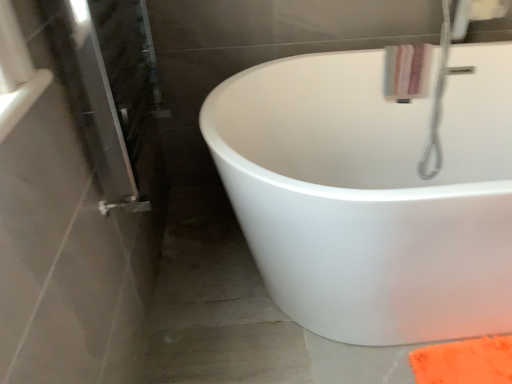
What do you see at coordinates (372, 194) in the screenshot?
I see `white glossy bathtub at center` at bounding box center [372, 194].

The width and height of the screenshot is (512, 384). Find the location of `white glossy bathtub at center`. white glossy bathtub at center is located at coordinates (372, 194).

Locate an element on the screen. This screenshot has height=384, width=512. striped cotton bath towel at upper right is located at coordinates (407, 71).

This screenshot has width=512, height=384. What do you see at coordinates (407, 71) in the screenshot?
I see `striped cotton bath towel at upper right` at bounding box center [407, 71].

The height and width of the screenshot is (384, 512). Identify the location of white glossy bathtub at center. (372, 194).

Considering the positions of objects striped cotton bath towel at upper right and white glossy bathtub at center in the image provided, who is more to the right, striped cotton bath towel at upper right or white glossy bathtub at center?

striped cotton bath towel at upper right.

In the scene shown: Which object is closer to the camera, striped cotton bath towel at upper right or white glossy bathtub at center?

white glossy bathtub at center is more forward.

Between point (412, 95) and point (347, 330), which one is positioned in front?

The point (347, 330) is in front.

From the image's perspective, is striped cotton bath towel at upper right located beneath white glossy bathtub at center?

No, from the image's perspective, striped cotton bath towel at upper right is not below white glossy bathtub at center.

From a real-world perspective, which is physically below, striped cotton bath towel at upper right or white glossy bathtub at center?

white glossy bathtub at center.

Which object is wider, striped cotton bath towel at upper right or white glossy bathtub at center?

With larger width is white glossy bathtub at center.

In the scene shown: Is striped cotton bath towel at upper right shorter than white glossy bathtub at center?

Correct, striped cotton bath towel at upper right is not as tall as white glossy bathtub at center.

From the picture: Between striped cotton bath towel at upper right and white glossy bathtub at center, which one has smaller size?

Smaller between the two is striped cotton bath towel at upper right.

Is striped cotton bath towel at upper right surrounding white glossy bathtub at center?

Actually, white glossy bathtub at center is outside striped cotton bath towel at upper right.

Is striped cotton bath towel at upper right with white glossy bathtub at center?

No, striped cotton bath towel at upper right is not with white glossy bathtub at center.

Is striped cotton bath towel at upper right oriented towards white glossy bathtub at center?

Yes, striped cotton bath towel at upper right faces towards white glossy bathtub at center.

Identify the location of bath towel above the white glossy bathtub at center (from the image's perspective). This screenshot has height=384, width=512. (407, 71).

Consider the image. Does white glossy bathtub at center appear on the right side of striped cotton bath towel at upper right?

No, white glossy bathtub at center is not to the right of striped cotton bath towel at upper right.

Consider the image. Considering the relative positions of white glossy bathtub at center and striped cotton bath towel at upper right in the image provided, is white glossy bathtub at center behind striped cotton bath towel at upper right?

No, the depth of white glossy bathtub at center is less than that of striped cotton bath towel at upper right.

Which is nearer, (365, 201) or (398, 68)?

Point (365, 201) is closer to the camera than point (398, 68).

From the image's perspective, would you say white glossy bathtub at center is shown under striped cotton bath towel at upper right?

Correct, white glossy bathtub at center appears lower than striped cotton bath towel at upper right in the image.

From a real-world perspective, is white glossy bathtub at center below striped cotton bath towel at upper right?

Yes, from a real-world perspective, white glossy bathtub at center is beneath striped cotton bath towel at upper right.

Can you confirm if white glossy bathtub at center is wider than striped cotton bath towel at upper right?

Indeed, white glossy bathtub at center has a greater width compared to striped cotton bath towel at upper right.

Considering the sizes of objects white glossy bathtub at center and striped cotton bath towel at upper right in the image provided, who is shorter, white glossy bathtub at center or striped cotton bath towel at upper right?

With less height is striped cotton bath towel at upper right.

Between white glossy bathtub at center and striped cotton bath towel at upper right, which one has larger size?

white glossy bathtub at center.

Is striped cotton bath towel at upper right located within white glossy bathtub at center?

Yes, striped cotton bath towel at upper right is a part of white glossy bathtub at center.

Is white glossy bathtub at center not near striped cotton bath towel at upper right?

They are positioned close to each other.

Is white glossy bathtub at center aimed at striped cotton bath towel at upper right?

No.

Measure the distance between white glossy bathtub at center and striped cotton bath towel at upper right.

17.18 inches.

What are the coordinates of `bath towel above the white glossy bathtub at center (from the image's perspective)` in the screenshot? It's located at (407, 71).

You are a GUI agent. You are given a task and a screenshot of the screen. Output one action in this format:
    pyautogui.click(x=<x>, y=<y>)
    Task: Click on the bath towel that appears above the white glossy bathtub at center (from a real-world perspective)
    
    Given the screenshot: What is the action you would take?
    pyautogui.click(x=407, y=71)

Where is `bath towel lying behind the white glossy bathtub at center`? bath towel lying behind the white glossy bathtub at center is located at coordinates (407, 71).